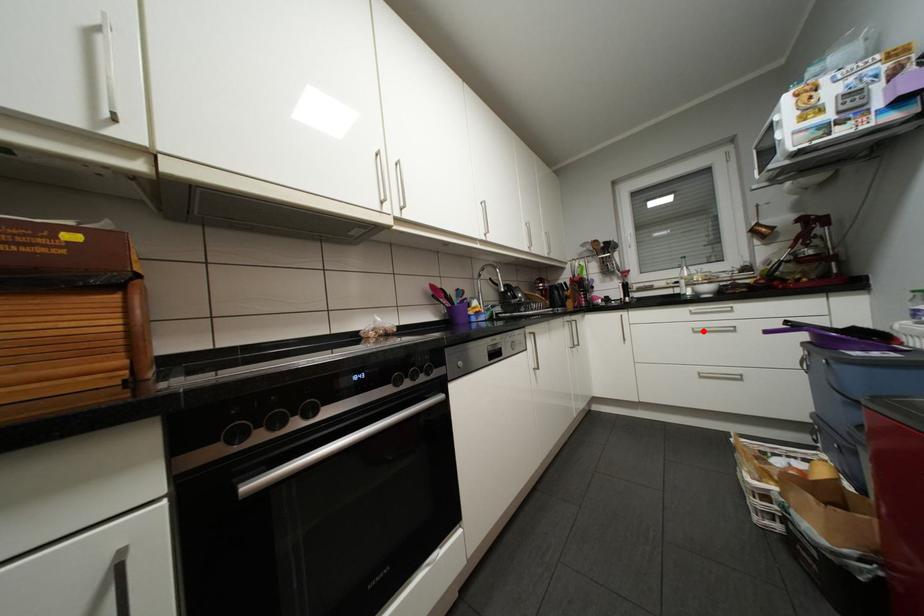
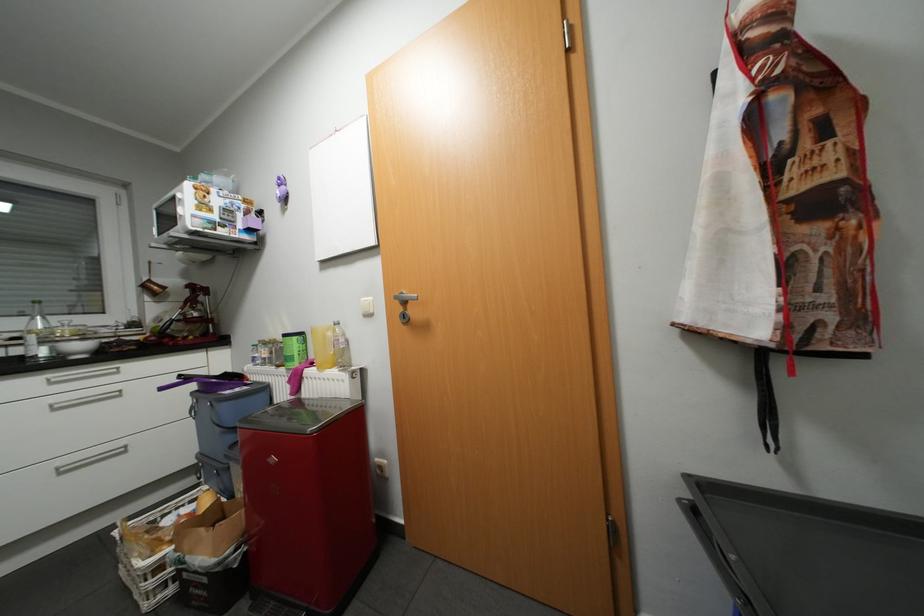
Where in the second image is the point corresponding to the highlighted location from the first image?

(64, 408)